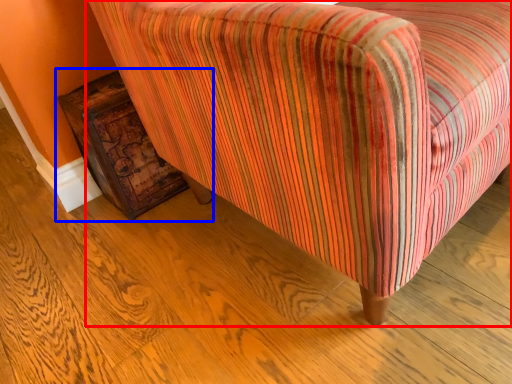
Question: Among these objects, which one is farthest to the camera, chair (highlighted by a red box) or furniture (highlighted by a blue box)?

Choices:
 (A) chair
 (B) furniture

Answer: (B)